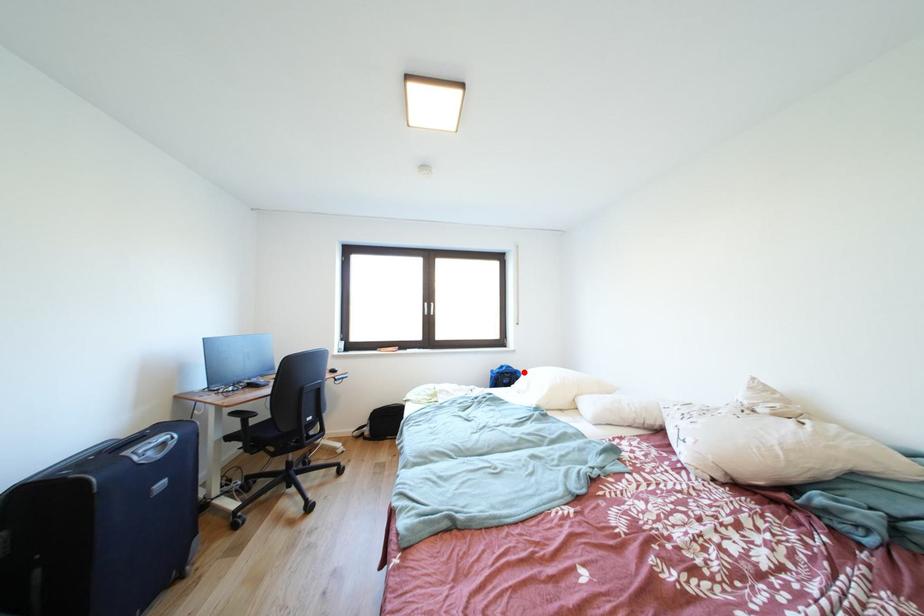
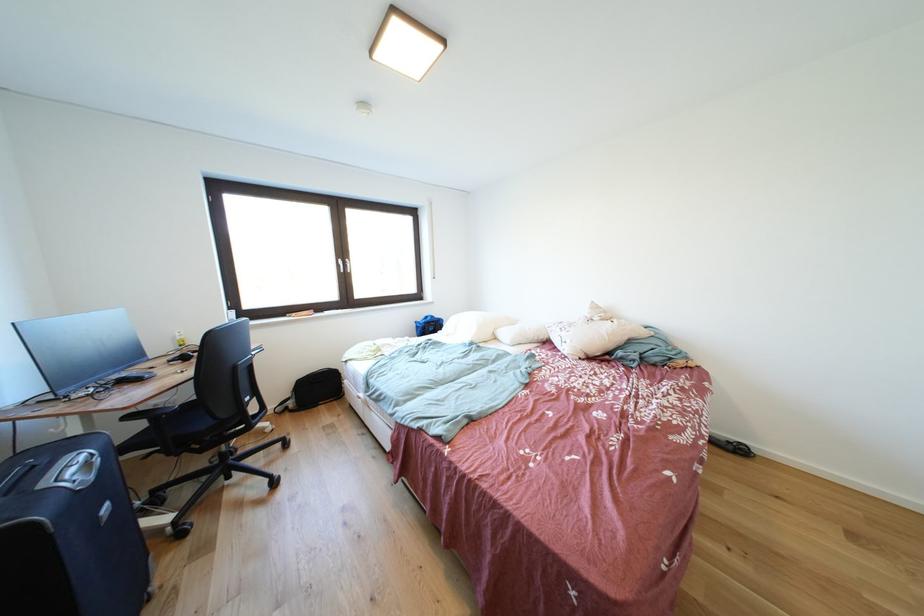
Where in the second image is the point corresponding to the highlighted location from the first image?

(445, 321)